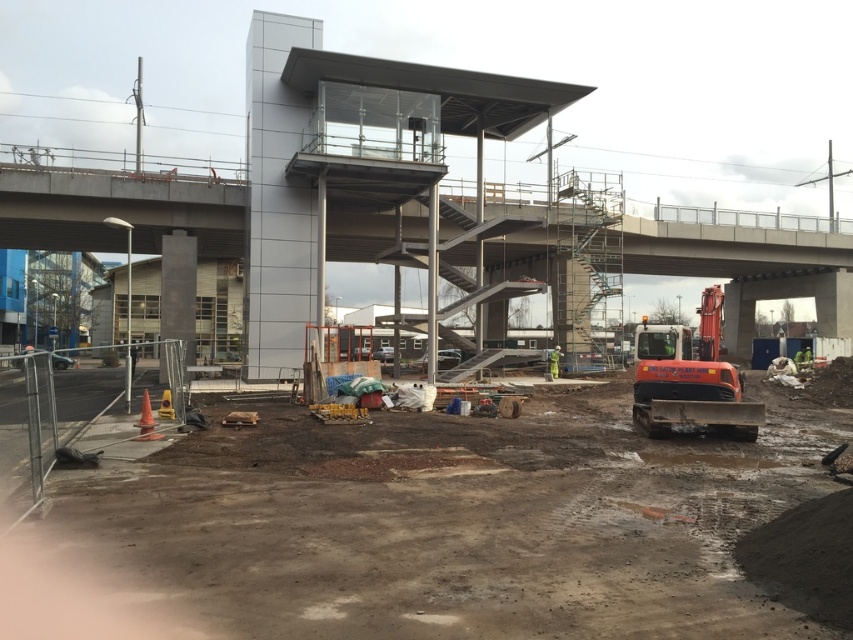
Question: Is muddy dirt at center smaller than concrete overpass at center?

Choices:
 (A) no
 (B) yes

Answer: (B)

Question: Which point appears farthest from the camera in this image?

Choices:
 (A) (723, 387)
 (B) (463, 568)

Answer: (A)

Question: Which point appears farthest from the camera in this image?

Choices:
 (A) (3, 166)
 (B) (659, 404)
 (C) (717, 625)

Answer: (A)

Question: Considering the relative positions of muddy dirt at center and concrete overpass at center in the image provided, where is muddy dirt at center located with respect to concrete overpass at center?

Choices:
 (A) below
 (B) above

Answer: (A)

Question: Which point appears farthest from the camera in this image?

Choices:
 (A) (653, 356)
 (B) (48, 205)
 (C) (387, 560)

Answer: (B)

Question: Does muddy dirt at center appear on the left side of concrete overpass at center?

Choices:
 (A) no
 (B) yes

Answer: (A)